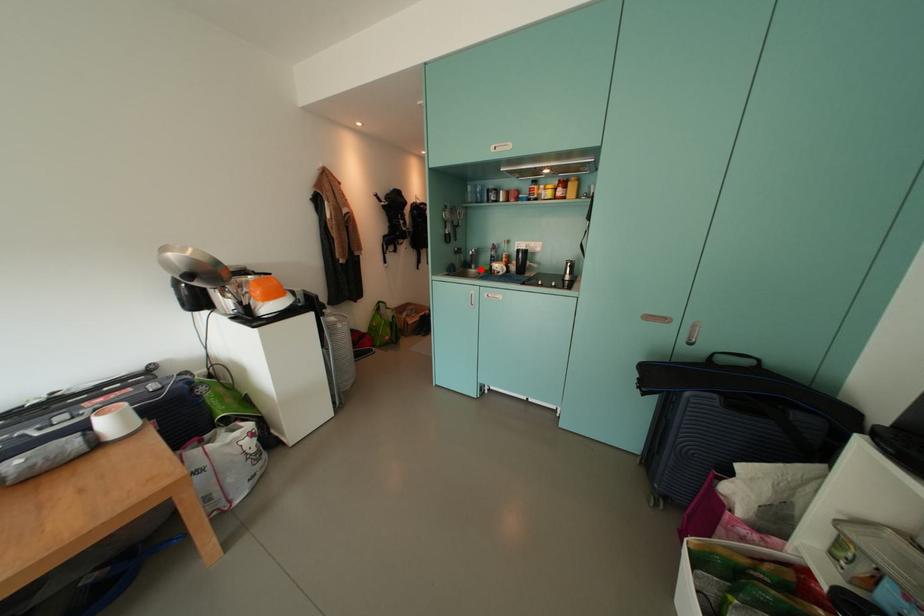
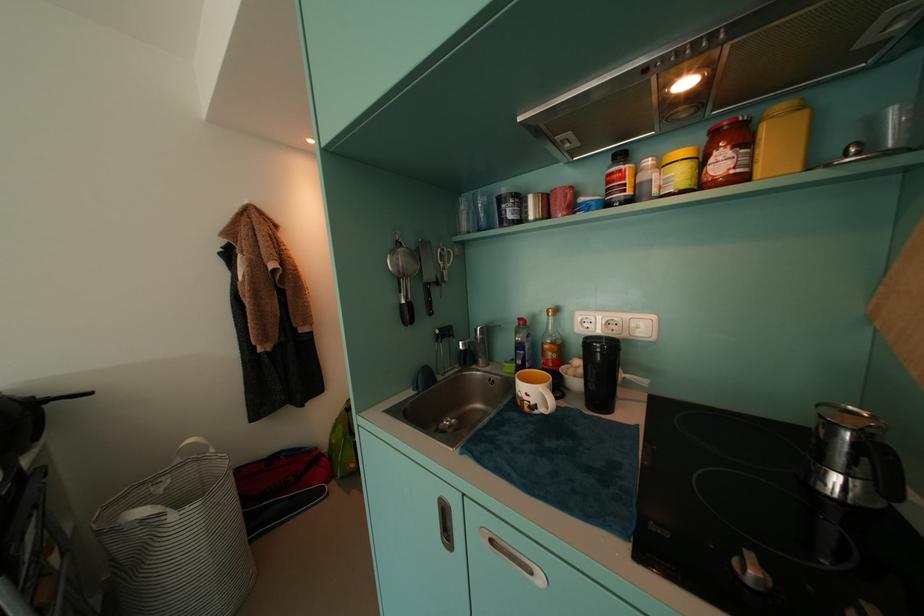
The point at the highlighted location is marked in the first image. Where is the corresponding point in the second image?

(488, 363)